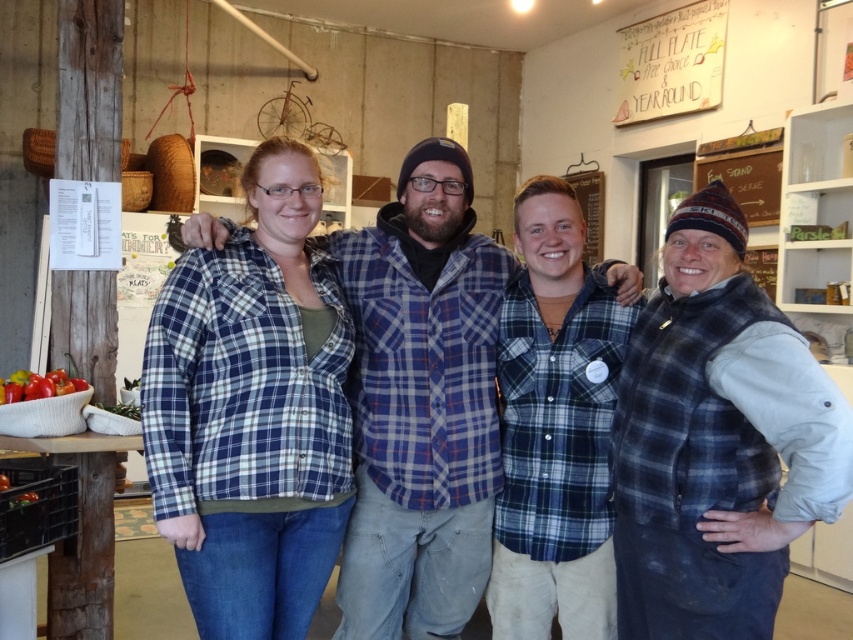
Question: Based on their relative distances, which object is nearer to the blue plaid shirt at center?

Choices:
 (A) wooden signboard at upper right
 (B) red glossy tomatoes at lower left

Answer: (B)

Question: Which object is farther from the camera taking this photo?

Choices:
 (A) wooden signboard at upper right
 (B) red glossy tomatoes at lower left
 (C) blue plaid shirt at center

Answer: (A)

Question: Does blue plaid shirt at center lie in front of wooden signboard at upper right?

Choices:
 (A) yes
 (B) no

Answer: (A)

Question: Can you confirm if blue plaid shirt at center is positioned above wooden signboard at upper right?

Choices:
 (A) yes
 (B) no

Answer: (B)

Question: Which point appears closest to the camera in this image?

Choices:
 (A) (10, 380)
 (B) (496, 300)

Answer: (B)

Question: Is the position of blue plaid shirt at center more distant than that of wooden signboard at upper right?

Choices:
 (A) no
 (B) yes

Answer: (A)